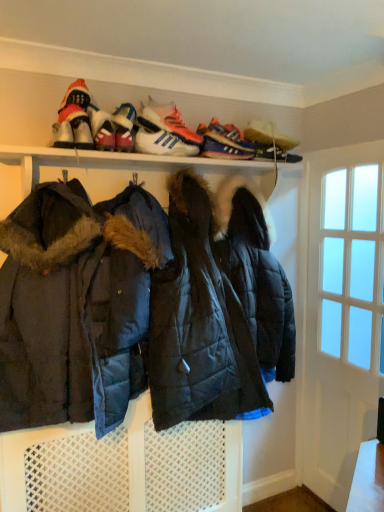
The image size is (384, 512). What are the coordinates of `free space above white glass door at right (from a real-world perspective)` in the screenshot? It's located at (356, 151).